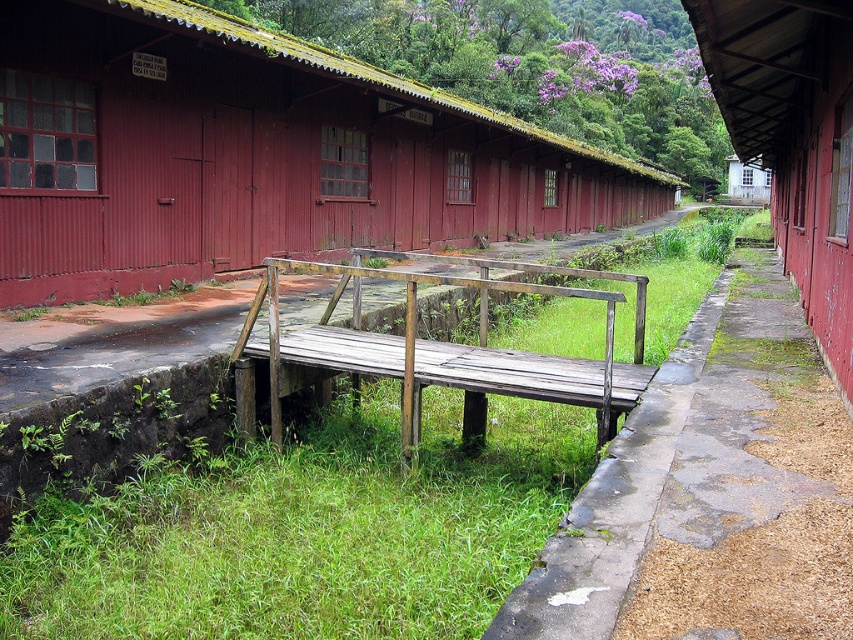
You are a construction worker needing to place a 5m long wooden plank between the rustic wood hut at center and the weathered wood rail at center. Based on the scene, can you determine if the plank will fit horizontally between them?

The rustic wood hut at center is wider than the weathered wood rail at center, so the 5m plank may not fit horizontally between them since the total available space might be less than 5 meters.